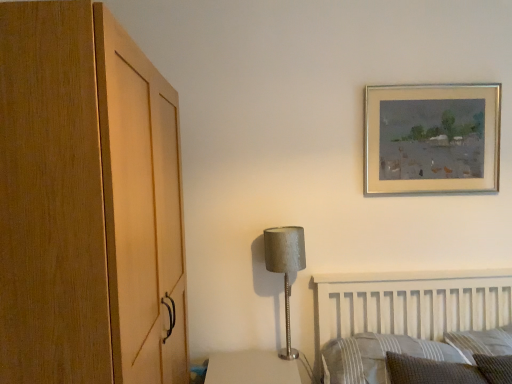
Question: Is the depth of textured gray pillow at lower right, the 1th pillow positioned from the right, greater than that of satin silver lamp at center?

Choices:
 (A) no
 (B) yes

Answer: (A)

Question: Is textured gray pillow at lower right, the 1th pillow positioned from the right, aimed at satin silver lamp at center?

Choices:
 (A) yes
 (B) no

Answer: (B)

Question: Can you confirm if textured gray pillow at lower right, the 3th pillow in the left-to-right sequence, is taller than satin silver lamp at center?

Choices:
 (A) no
 (B) yes

Answer: (A)

Question: Is textured gray pillow at lower right, the 1th pillow positioned from the right, to the left of satin silver lamp at center from the viewer's perspective?

Choices:
 (A) yes
 (B) no

Answer: (B)

Question: Considering the relative positions of textured gray pillow at lower right, the 3th pillow in the left-to-right sequence, and satin silver lamp at center in the image provided, is textured gray pillow at lower right, the 3th pillow in the left-to-right sequence, to the right of satin silver lamp at center from the viewer's perspective?

Choices:
 (A) yes
 (B) no

Answer: (A)

Question: Considering the relative sizes of textured gray pillow at lower right, the 3th pillow in the left-to-right sequence, and satin silver lamp at center in the image provided, is textured gray pillow at lower right, the 3th pillow in the left-to-right sequence, bigger than satin silver lamp at center?

Choices:
 (A) yes
 (B) no

Answer: (A)

Question: Is woven fabric pillow at lower right, placed as the 2th pillow when sorted from left to right, to the left of striped fabric pillow at lower right, positioned as the first pillow in left-to-right order, from the viewer's perspective?

Choices:
 (A) no
 (B) yes

Answer: (A)

Question: Is woven fabric pillow at lower right, positioned as the 2th pillow in right-to-left order, positioned before striped fabric pillow at lower right, the 3th pillow from the right?

Choices:
 (A) yes
 (B) no

Answer: (A)

Question: Can you confirm if woven fabric pillow at lower right, positioned as the 2th pillow in right-to-left order, is shorter than striped fabric pillow at lower right, positioned as the first pillow in left-to-right order?

Choices:
 (A) yes
 (B) no

Answer: (A)

Question: Does woven fabric pillow at lower right, positioned as the 2th pillow in right-to-left order, turn towards striped fabric pillow at lower right, the 3th pillow from the right?

Choices:
 (A) no
 (B) yes

Answer: (A)

Question: Is woven fabric pillow at lower right, positioned as the 2th pillow in right-to-left order, located outside striped fabric pillow at lower right, positioned as the first pillow in left-to-right order?

Choices:
 (A) yes
 (B) no

Answer: (B)

Question: From the image's perspective, would you say woven fabric pillow at lower right, placed as the 2th pillow when sorted from left to right, is positioned over striped fabric pillow at lower right, positioned as the first pillow in left-to-right order?

Choices:
 (A) no
 (B) yes

Answer: (B)

Question: Does woven fabric pillow at lower right, placed as the 2th pillow when sorted from left to right, have a lesser height compared to textured gray pillow at lower right, the 1th pillow positioned from the right?

Choices:
 (A) yes
 (B) no

Answer: (A)